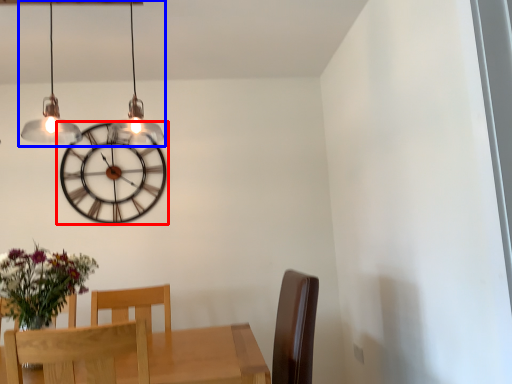
Question: Among these objects, which one is farthest to the camera, wall clock (highlighted by a red box) or lamp (highlighted by a blue box)?

Choices:
 (A) wall clock
 (B) lamp

Answer: (A)